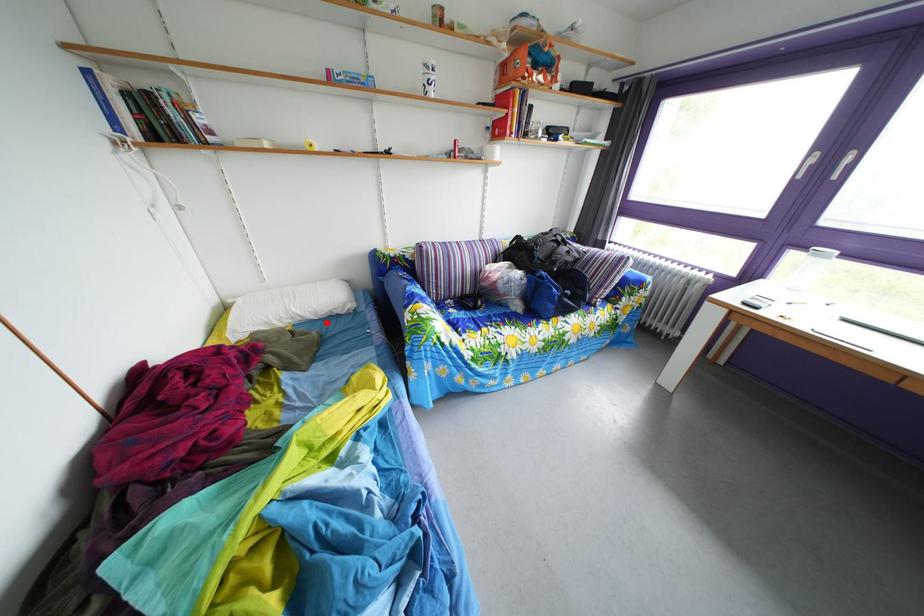
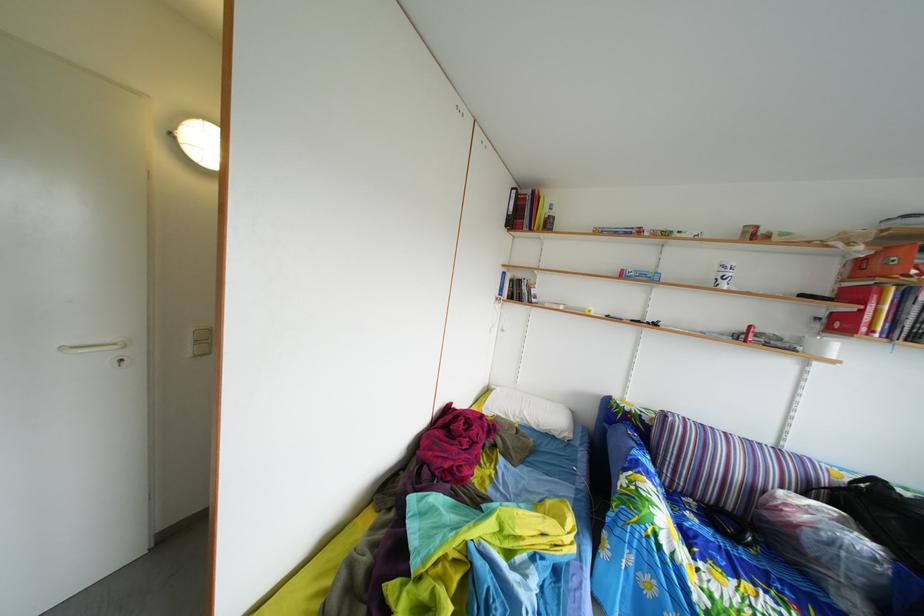
Question: A red point is marked in image1. In image2, is the corresponding 3D point closer to the camera or farther? Reply with the corresponding letter.

Choices:
 (A) The corresponding 3D point is closer.
 (B) The corresponding 3D point is farther.

Answer: (B)